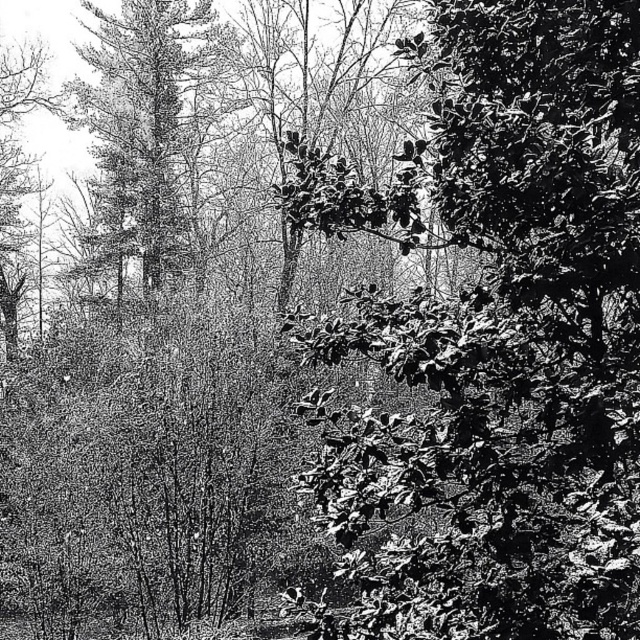
Question: Is shiny green leaves at center bigger than smooth bark tree at left?

Choices:
 (A) no
 (B) yes

Answer: (A)

Question: Is shiny green leaves at center bigger than smooth bark tree at left?

Choices:
 (A) yes
 (B) no

Answer: (B)

Question: Which of the following is the farthest from the observer?

Choices:
 (A) shiny green leaves at center
 (B) smooth bark tree at left

Answer: (B)

Question: Is shiny green leaves at center positioned at the back of smooth bark tree at left?

Choices:
 (A) no
 (B) yes

Answer: (A)